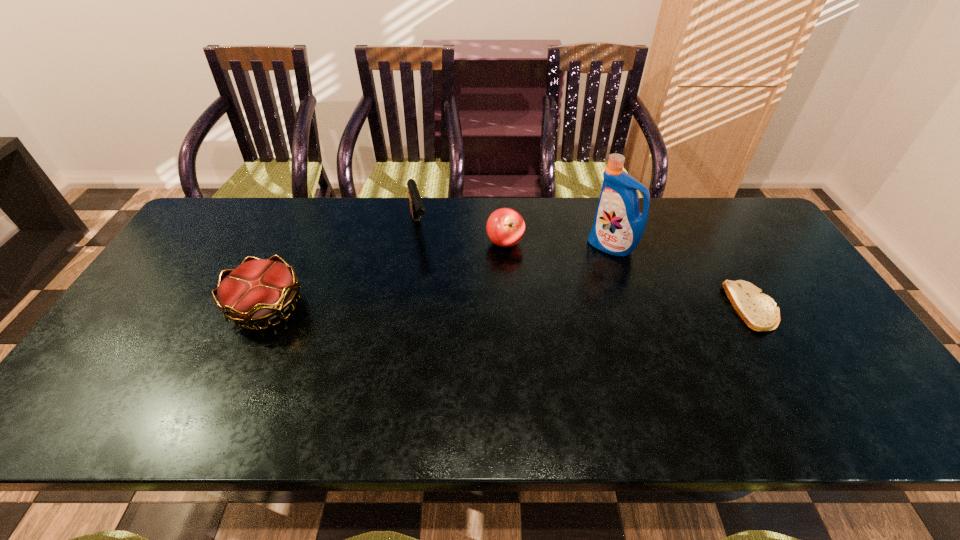
I want to click on vacant space on the desktop that is between the crown and the rightmost object and is positioned on the label of the fourth object from left to right, so click(x=529, y=307).

This screenshot has height=540, width=960. What are the coordinates of `free space on the desktop that is between the crown and the rightmost object and is positioned on the stem of the third object from right to left` in the screenshot? It's located at (469, 307).

The image size is (960, 540). In order to click on vacant spot on the desktop that is between the crown and the rightmost object and is positioned at the barrel of the second object from left to right in this screenshot , I will do `click(445, 307)`.